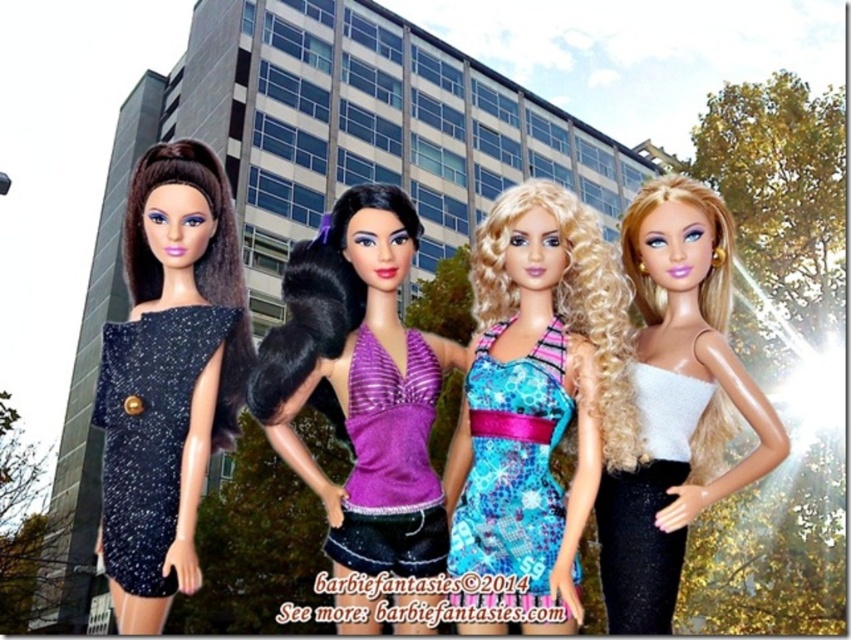
Is sparkly black dress at left wider than blue printed fabric dress at center?

Correct, the width of sparkly black dress at left exceeds that of blue printed fabric dress at center.

Looking at this image, between sparkly black dress at left and blue printed fabric dress at center, which one has less height?

Standing shorter between the two is blue printed fabric dress at center.

Does point (175, 580) come farther from viewer compared to point (470, 602)?

Yes, point (175, 580) is farther from viewer.

Locate an element on the screen. sparkly black dress at left is located at coordinates (155, 429).

Is purple shiny halter top at center wider than blue printed fabric dress at center?

Indeed, purple shiny halter top at center has a greater width compared to blue printed fabric dress at center.

Who is higher up, purple shiny halter top at center or blue printed fabric dress at center?

purple shiny halter top at center is above.

Where is `purple shiny halter top at center`? The height and width of the screenshot is (640, 851). purple shiny halter top at center is located at coordinates (360, 385).

Find the location of a particular element. purple shiny halter top at center is located at coordinates (360, 385).

Can you confirm if shiny silver dress at right is positioned to the left of white sequined dress at right?

In fact, shiny silver dress at right is to the right of white sequined dress at right.

Describe the element at coordinates (677, 401) in the screenshot. I see `shiny silver dress at right` at that location.

This screenshot has height=640, width=851. I want to click on shiny silver dress at right, so click(677, 401).